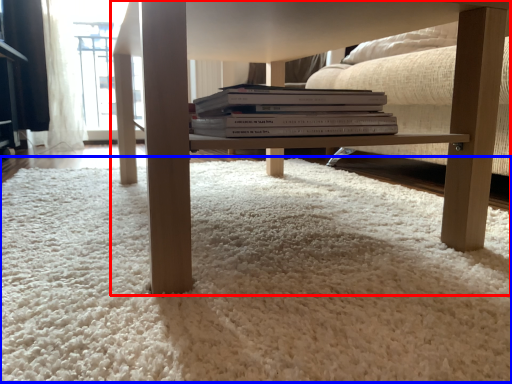
Question: Which object appears closest to the camera in this image, table (highlighted by a red box) or plain (highlighted by a blue box)?

Choices:
 (A) table
 (B) plain

Answer: (B)